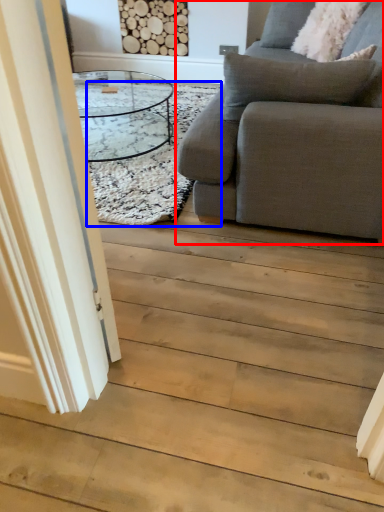
Question: Which point is further to the camera, studio couch (highlighted by a red box) or mat (highlighted by a blue box)?

Choices:
 (A) studio couch
 (B) mat

Answer: (B)